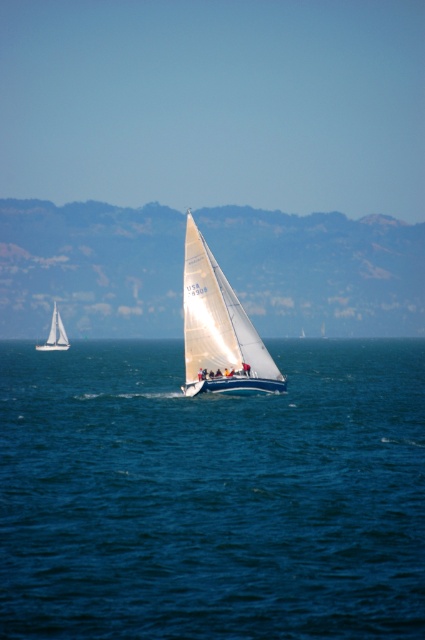
Question: Which of these objects is positioned closest to the white matte sailboat at left?

Choices:
 (A) white matte sailboat at center
 (B) blue water at center

Answer: (B)

Question: Is blue water at center positioned behind white sailboat at upper center?

Choices:
 (A) no
 (B) yes

Answer: (A)

Question: Can you confirm if white sailboat at upper center is smaller than white matte sailboat at left?

Choices:
 (A) no
 (B) yes

Answer: (A)

Question: Which point appears farthest from the camera in this image?

Choices:
 (A) (56, 314)
 (B) (122, 260)

Answer: (B)

Question: Estimate the real-world distances between objects in this image. Which object is farther from the blue water at center?

Choices:
 (A) white sailboat at upper center
 (B) white matte sailboat at center
 (C) white matte sailboat at left

Answer: (A)

Question: In this image, where is white matte sailboat at center located relative to white matte sailboat at left?

Choices:
 (A) below
 (B) above

Answer: (B)